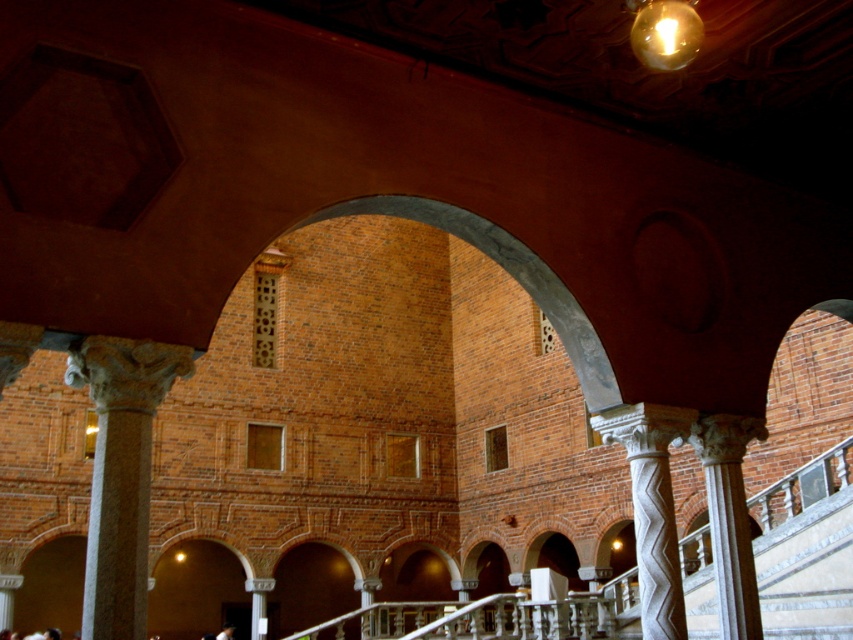
You are an architect designing a new building and want to incorporate columns similar to those in the image. If you want to place a column that is smaller in size, which one should you choose between the white stone column at left and the white marble column at center?

The white marble column at center is smaller in size compared to the white stone column at left, so you should choose the white marble column at center if you want a smaller column.

You are standing in the grand architectural space and want to locate the white stone column at left. According to the coordinates provided, where should you look relative to the center of the image?

The white stone column at left is located at coordinates point (120, 474), which means it is positioned to the right and slightly below the center of the image.

You are an architect examining the interior of a historical building. You notice the white stone column at left and the white carved column at center. Which column is positioned higher up in the space?

The white stone column at left is positioned higher up in the space as it is above the white carved column at center.